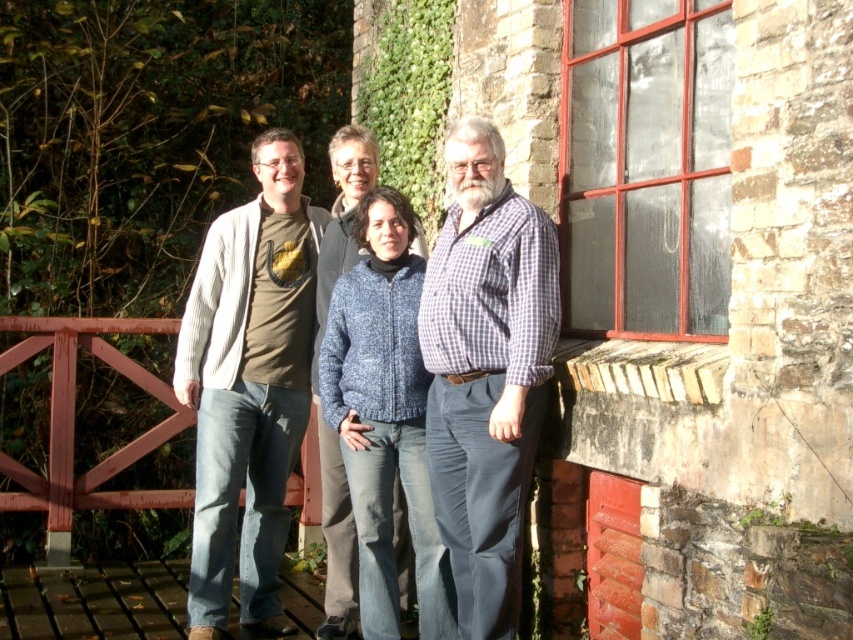
You are a photographer trying to capture a photo of the checkered fabric shirt at center and the matte gray cardigan at left. Which of the two items should you focus on first if you want to ensure both are in the frame without moving the camera?

The checkered fabric shirt at center is located above the matte gray cardigan at left, so you should focus on the matte gray cardigan at left first to ensure both are in the frame without moving the camera.

You are a photographer trying to capture a group photo of the checkered fabric shirt at center and the knitted blue sweater at center. The camera you are using has a minimum focus distance of 1.6 meters. Will you be able to focus on both subjects clearly without moving them?

The distance between the checkered fabric shirt at center and the knitted blue sweater at center is 1.56 meters, which is less than the camera minimum focus distance of 1.6 meters. Therefore, the camera may struggle to focus on both subjects clearly without moving them closer together or adjusting the camera settings.

You are a photographer trying to arrange two people wearing the checkered fabric shirt at center and the knitted blue sweater at center for a photo. Which person should stand to the left to maintain their original positions?

The knitted blue sweater at center should stand to the left because the checkered fabric shirt at center is positioned on the right side of knitted blue sweater at center in the original image.